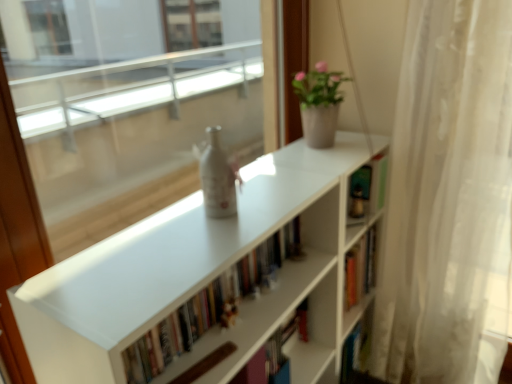
Question: Is white matte bookshelf at center wider or thinner than matte white pot at upper right?

Choices:
 (A) thin
 (B) wide

Answer: (A)

Question: From the image's perspective, is white matte bookshelf at center located above or below matte white pot at upper right?

Choices:
 (A) above
 (B) below

Answer: (B)

Question: Based on their relative distances, which object is farther from the matte white pot at upper right?

Choices:
 (A) white sheer curtain at right
 (B) white matte bookshelf at center
 (C) white matte bookcase at center

Answer: (B)

Question: Estimate the real-world distances between objects in this image. Which object is closer to the white sheer curtain at right?

Choices:
 (A) matte white pot at upper right
 (B) white matte bookshelf at center
 (C) white matte bookcase at center

Answer: (A)